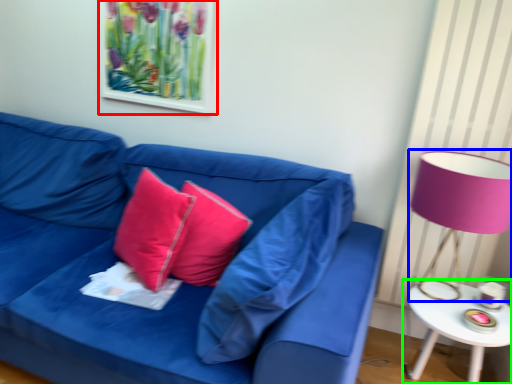
Question: Considering the real-world distances, which object is closest to picture frame (highlighted by a red box)? table lamp (highlighted by a blue box) or table (highlighted by a green box).

Choices:
 (A) table lamp
 (B) table

Answer: (A)